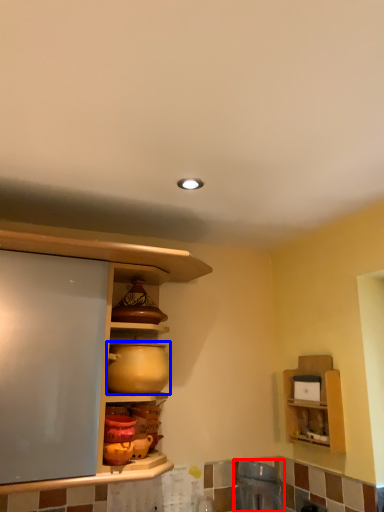
Question: Which object appears farthest to the camera in this image, appliance (highlighted by a red box) or appliance (highlighted by a blue box)?

Choices:
 (A) appliance
 (B) appliance

Answer: (A)